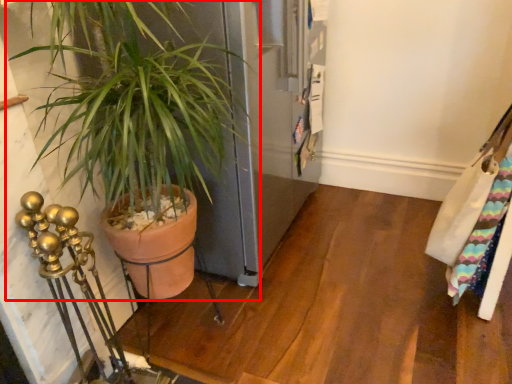
Question: Observing the image, what is the correct spatial positioning of houseplant (annotated by the red box) in reference to messenger bag?

Choices:
 (A) right
 (B) left

Answer: (B)